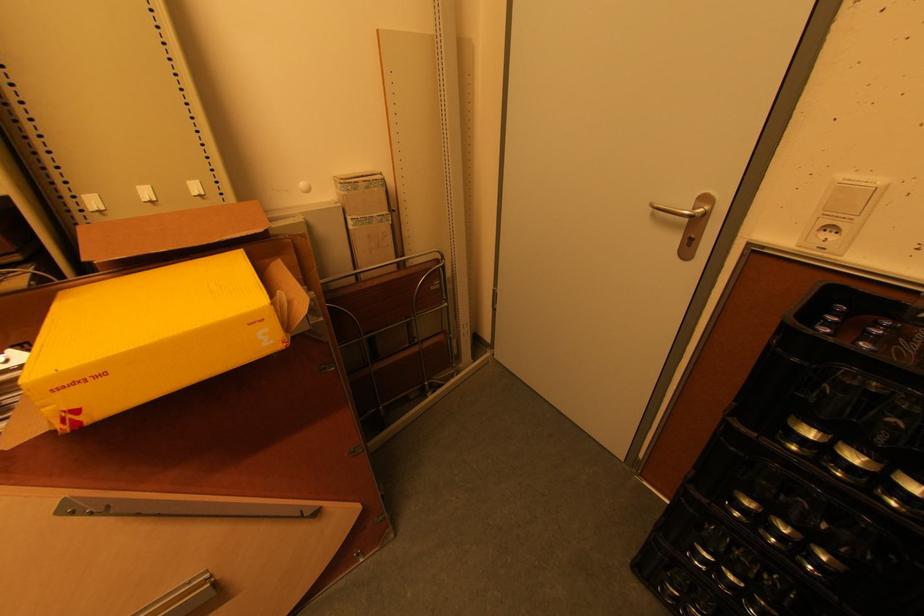
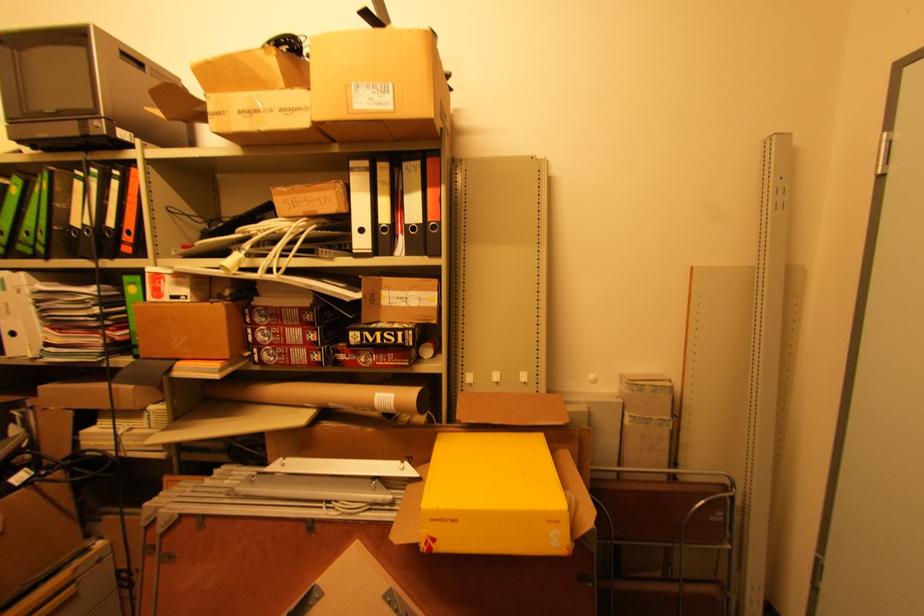
The point at (78, 384) is marked in the first image. Where is the corresponding point in the second image?

(444, 521)